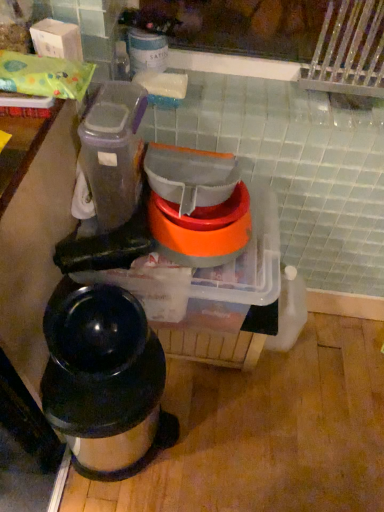
At what (x,y) coordinates should I click in order to perform the action: click on empty space that is ontop of orange translucent bowls at center, which appears as the 2th appliance when ordered from the bottom. Please return your answer as a coordinate pair (x, y). Looking at the image, I should click on (213, 212).